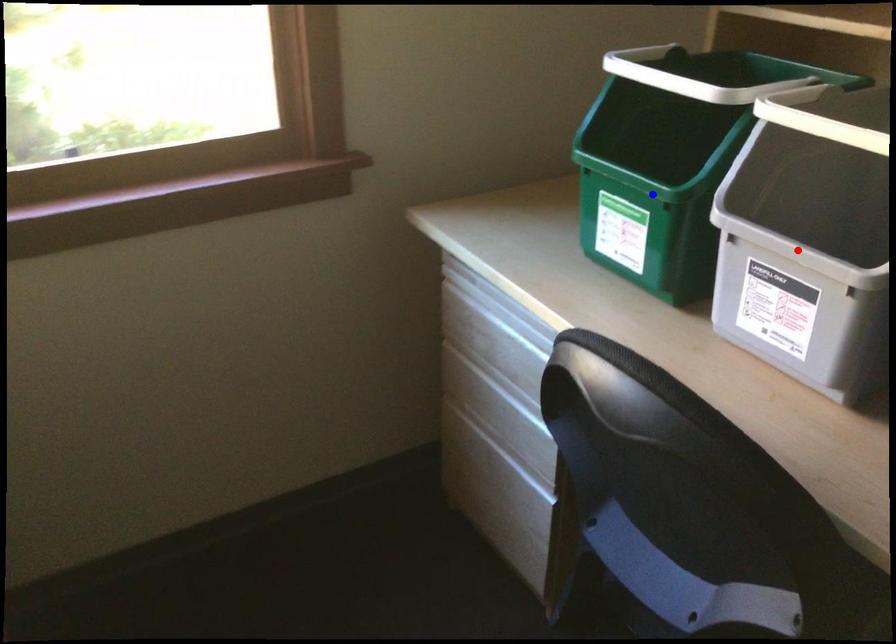
Question: Which of the two points in the image is closer to the camera?

Choices:
 (A) Blue point is closer.
 (B) Red point is closer.

Answer: (B)